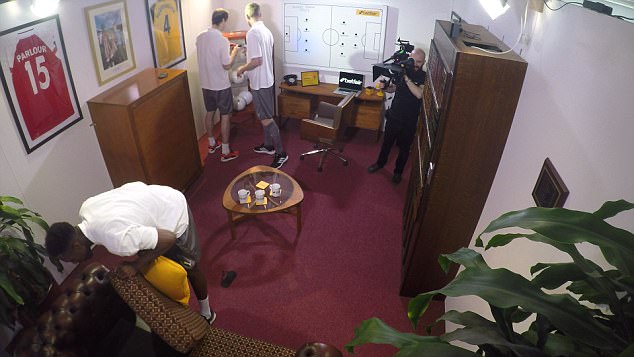
Image resolution: width=634 pixels, height=357 pixels. I want to click on sofa, so click(73, 301).